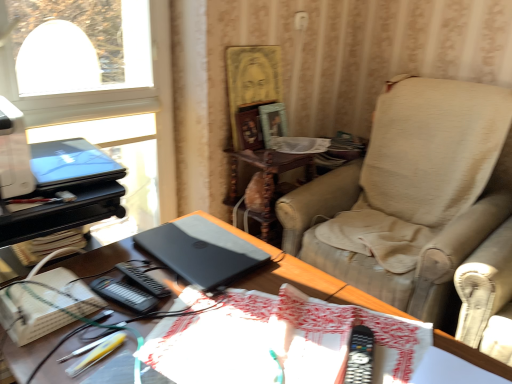
At what (x,y) coordinates should I click in order to perform the action: click on unoccupied region to the right of black plastic remote control at lower right. Please return your answer as a coordinate pair (x, y). This screenshot has width=512, height=384. Looking at the image, I should click on (414, 353).